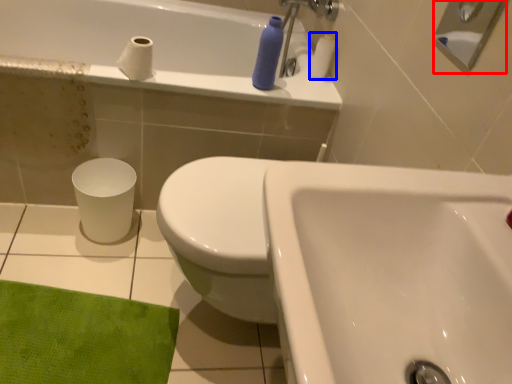
Question: Which point is further to the camera, shower (highlighted by a red box) or toilet paper (highlighted by a blue box)?

Choices:
 (A) shower
 (B) toilet paper

Answer: (B)